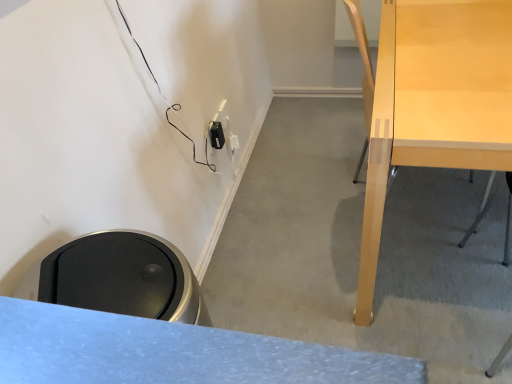
Where is `vacant space behind light wood desk at right`? Image resolution: width=512 pixels, height=384 pixels. vacant space behind light wood desk at right is located at coordinates (317, 149).